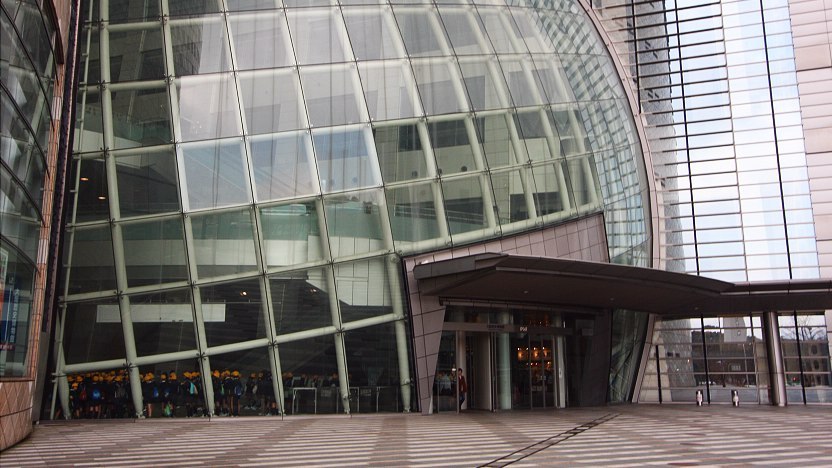
This screenshot has width=832, height=468. I want to click on metal grey overhang over door, so click(x=547, y=263).